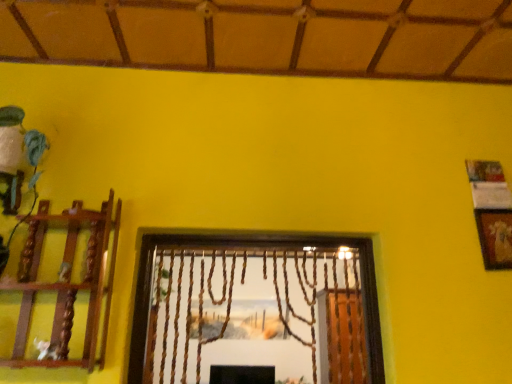
Question: Considering their positions, is gold textured picture frame at upper right located in front of or behind wooden at left?

Choices:
 (A) front
 (B) behind

Answer: (B)

Question: Considering the positions of gold textured picture frame at upper right and wooden at left in the image, is gold textured picture frame at upper right bigger or smaller than wooden at left?

Choices:
 (A) big
 (B) small

Answer: (B)

Question: Considering the positions of gold textured picture frame at upper right and wooden at left in the image, is gold textured picture frame at upper right taller or shorter than wooden at left?

Choices:
 (A) tall
 (B) short

Answer: (B)

Question: In the image, is wooden at left positioned in front of or behind gold textured picture frame at upper right?

Choices:
 (A) front
 (B) behind

Answer: (A)

Question: Is wooden at left spatially inside gold textured picture frame at upper right, or outside of it?

Choices:
 (A) outside
 (B) inside

Answer: (A)

Question: From a real-world perspective, is wooden at left physically located above or below gold textured picture frame at upper right?

Choices:
 (A) below
 (B) above

Answer: (A)

Question: Does point (94, 240) appear closer or farther from the camera than point (502, 215)?

Choices:
 (A) farther
 (B) closer

Answer: (B)